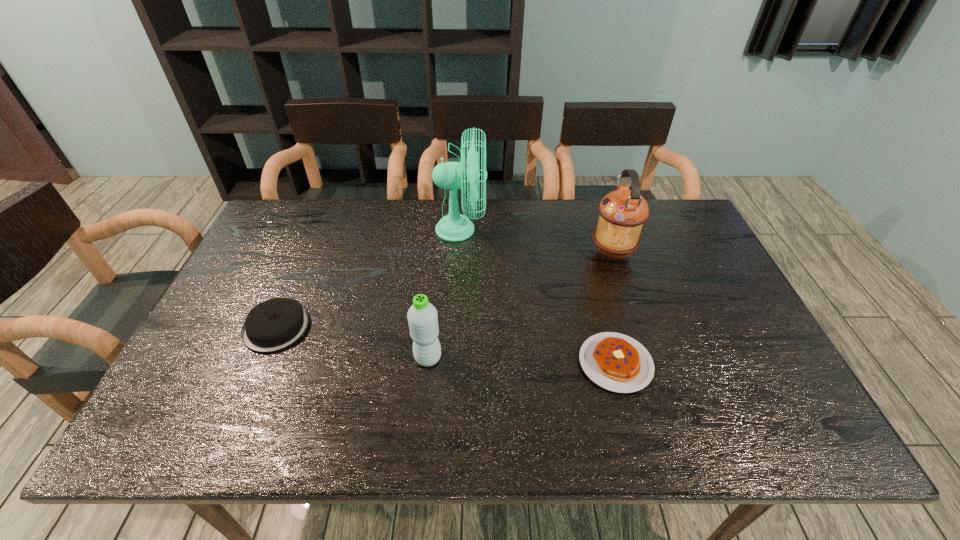
You are a GUI agent. You are given a task and a screenshot of the screen. Output one action in this format:
    pyautogui.click(x=<x>, y=<y>)
    Task: Click on the blank region between the tallest object and the fourth tallest object
    This screenshot has width=960, height=540.
    Given the screenshot: What is the action you would take?
    pyautogui.click(x=369, y=279)

Locate an element on the screen. This screenshot has height=540, width=960. free space between the third shortest object and the taller pancake is located at coordinates (352, 342).

The image size is (960, 540). In order to click on object that is the fourth closest to the third tallest object in this screenshot , I will do `click(623, 212)`.

Locate which object is the fourth closest to the second tallest object. Please provide its 2D coordinates. Your answer should be formatted as a tuple, i.e. [(x, y)], where the tuple contains the x and y coordinates of a point satisfying the conditions above.

[(275, 324)]

Identify the location of vacant space that satisfies the following two spatial constraints: 1. in front of the tallest object to blow air; 2. on the front side of the water bottle. This screenshot has width=960, height=540. (455, 358).

The height and width of the screenshot is (540, 960). I want to click on free location that satisfies the following two spatial constraints: 1. on the front side of the second shortest object; 2. on the left side of the shortest object, so click(x=261, y=363).

Identify the location of free spot that satisfies the following two spatial constraints: 1. on the front side of the third tallest object; 2. on the left side of the leftmost object. Image resolution: width=960 pixels, height=540 pixels. (264, 358).

Locate an element on the screen. The image size is (960, 540). free point that satisfies the following two spatial constraints: 1. in front of the tallest object to blow air; 2. on the right side of the shortest object is located at coordinates (454, 363).

At what (x,y) coordinates should I click in order to perform the action: click on free spot that satisfies the following two spatial constraints: 1. in front of the oil lamp to blow air; 2. on the right side of the fan. Please return your answer as a coordinate pair (x, y). This screenshot has width=960, height=540. Looking at the image, I should click on (460, 253).

The image size is (960, 540). I want to click on free space that satisfies the following two spatial constraints: 1. on the back side of the water bottle; 2. on the right side of the fourth shortest object, so click(x=439, y=253).